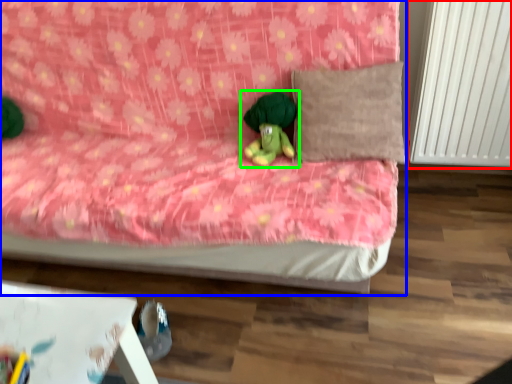
Question: Considering the real-world distances, which object is closest to radiator (highlighted by a red box)? bed (highlighted by a blue box) or toy (highlighted by a green box).

Choices:
 (A) bed
 (B) toy

Answer: (B)